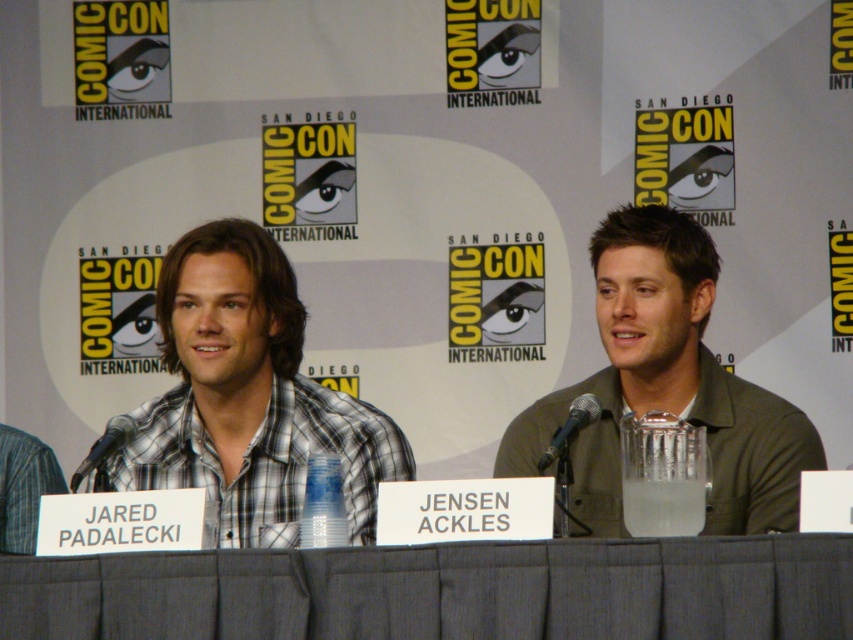
Can you confirm if gray fabric table at center is positioned above green matte shirt at center?

Incorrect, gray fabric table at center is not positioned above green matte shirt at center.

Is point (602, 618) in front of point (779, 412)?

Yes, point (602, 618) is in front of point (779, 412).

Locate an element on the screen. gray fabric table at center is located at coordinates (444, 592).

In the scene shown: Who is more distant from viewer, (262, 515) or (802, 444)?

The point (262, 515) is behind.

Is point (287, 476) behind point (764, 392)?

No.

Find the location of a particular element. The image size is (853, 640). plaid cotton shirt at left is located at coordinates (247, 400).

The width and height of the screenshot is (853, 640). I want to click on gray fabric table at center, so click(x=444, y=592).

Does point (136, 573) lie in front of point (283, 525)?

Yes, point (136, 573) is closer to viewer.

Is point (705, 561) closer to viewer compared to point (268, 468)?

Yes, it is in front of point (268, 468).

At what (x,y) coordinates should I click in order to perform the action: click on gray fabric table at center. Please return your answer as a coordinate pair (x, y). This screenshot has height=640, width=853. Looking at the image, I should click on pos(444,592).